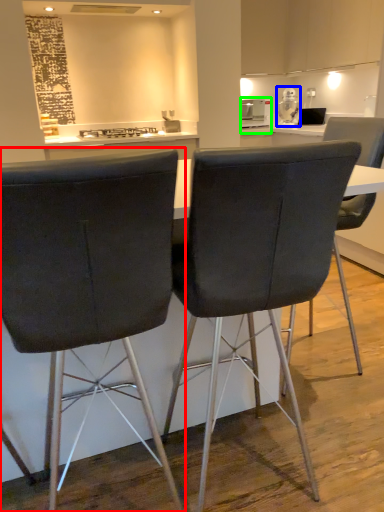
Question: Which object is the closest to the chair (highlighted by a red box)? Choose among these: appliance (highlighted by a blue box) or appliance (highlighted by a green box).

Choices:
 (A) appliance
 (B) appliance

Answer: (B)